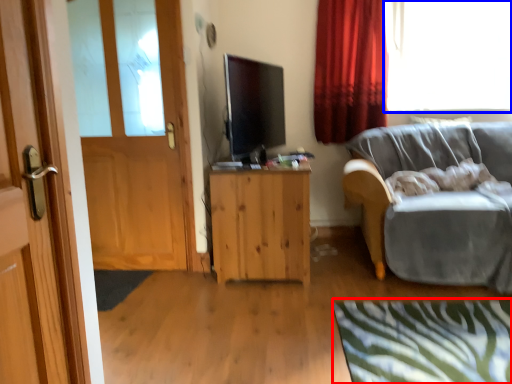
Question: Which point is closer to the camera, plain (highlighted by a red box) or window (highlighted by a blue box)?

Choices:
 (A) plain
 (B) window

Answer: (A)